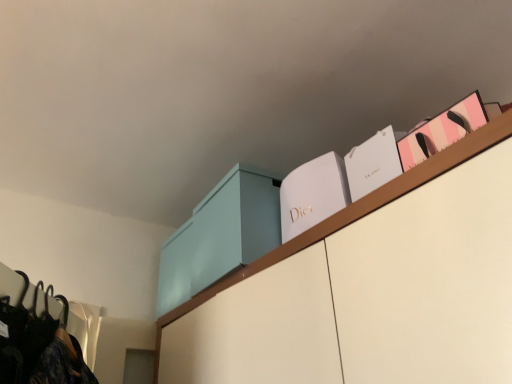
This screenshot has width=512, height=384. In order to click on white matte dior box at upper center, which appears as the first book when viewed from the left in this screenshot , I will do `click(312, 194)`.

Describe the element at coordinates (312, 194) in the screenshot. I see `white matte dior box at upper center, marked as the 3th book in a right-to-left arrangement` at that location.

The width and height of the screenshot is (512, 384). What do you see at coordinates (221, 235) in the screenshot? I see `light blue matte cabinet at upper center` at bounding box center [221, 235].

At what (x,y) coordinates should I click in order to perform the action: click on white matte dior box at upper center, which appears as the first book when viewed from the left. Please return your answer as a coordinate pair (x, y). The width and height of the screenshot is (512, 384). Looking at the image, I should click on (312, 194).

Is pink paper bag at upper right, the 3th book from the left, at the back of light blue matte cabinet at upper center?

No, pink paper bag at upper right, the 3th book from the left, is not at the back of light blue matte cabinet at upper center.

From the image's perspective, which one is positioned lower, light blue matte cabinet at upper center or pink paper bag at upper right, the 3th book from the left?

light blue matte cabinet at upper center.

Does light blue matte cabinet at upper center have a lesser height compared to pink paper bag at upper right, the 1th book positioned from the right?

Incorrect, the height of light blue matte cabinet at upper center does not fall short of that of pink paper bag at upper right, the 1th book positioned from the right.

Based on the photo, is light blue matte cabinet at upper center not near pink paper bag at upper right, the 1th book positioned from the right?

light blue matte cabinet at upper center is near pink paper bag at upper right, the 1th book positioned from the right, not far away.

Is pink paper bag at upper right, the 1th book positioned from the right, turned away from light blue matte cabinet at upper center?

No.

From a real-world perspective, which is physically below, pink paper bag at upper right, the 1th book positioned from the right, or light blue matte cabinet at upper center?

pink paper bag at upper right, the 1th book positioned from the right, is physically lower.

Does pink paper bag at upper right, the 3th book from the left, have a smaller size compared to light blue matte cabinet at upper center?

Correct, pink paper bag at upper right, the 3th book from the left, occupies less space than light blue matte cabinet at upper center.

In terms of width, does pink paper bag at upper right, the 1th book positioned from the right, look wider or thinner when compared to light blue matte cabinet at upper center?

In the image, pink paper bag at upper right, the 1th book positioned from the right, appears to be more narrow than light blue matte cabinet at upper center.

From a real-world perspective, is white paper bag at upper right, marked as the 2th book in a right-to-left arrangement, under pink paper bag at upper right, the 3th book from the left?

Incorrect, from a real-world perspective, white paper bag at upper right, marked as the 2th book in a right-to-left arrangement, is higher than pink paper bag at upper right, the 3th book from the left.

Which object is thinner, white paper bag at upper right, marked as the 2th book in a right-to-left arrangement, or pink paper bag at upper right, the 1th book positioned from the right?

With smaller width is white paper bag at upper right, marked as the 2th book in a right-to-left arrangement.

Which is in front, point (349, 172) or point (435, 117)?

The point (349, 172) is more forward.

Is white paper bag at upper right, the 2th book in the left-to-right sequence, aimed at pink paper bag at upper right, the 3th book from the left?

No, white paper bag at upper right, the 2th book in the left-to-right sequence, is not facing towards pink paper bag at upper right, the 3th book from the left.

Is light blue matte cabinet at upper center turned away from white paper bag at upper right, the 2th book in the left-to-right sequence?

light blue matte cabinet at upper center is not turned away from white paper bag at upper right, the 2th book in the left-to-right sequence.

Find the location of a particular element. The height and width of the screenshot is (384, 512). book that is the 2nd one below the light blue matte cabinet at upper center (from a real-world perspective) is located at coordinates (372, 163).

Based on the photo, from a real-world perspective, is light blue matte cabinet at upper center under white paper bag at upper right, marked as the 2th book in a right-to-left arrangement?

Incorrect, from a real-world perspective, light blue matte cabinet at upper center is higher than white paper bag at upper right, marked as the 2th book in a right-to-left arrangement.

Between light blue matte cabinet at upper center and white paper bag at upper right, the 2th book in the left-to-right sequence, which one has smaller size?

white paper bag at upper right, the 2th book in the left-to-right sequence.

Which is in front, white matte dior box at upper center, which appears as the first book when viewed from the left, or light blue matte cabinet at upper center?

white matte dior box at upper center, which appears as the first book when viewed from the left, is closer to the camera.

Is white matte dior box at upper center, marked as the 3th book in a right-to-left arrangement, positioned far away from light blue matte cabinet at upper center?

No.

Is light blue matte cabinet at upper center at the back of white matte dior box at upper center, which appears as the first book when viewed from the left?

No, white matte dior box at upper center, which appears as the first book when viewed from the left, is not facing away from light blue matte cabinet at upper center.

Image resolution: width=512 pixels, height=384 pixels. I want to click on the 1st book to the right of the light blue matte cabinet at upper center, starting your count from the anchor, so click(x=312, y=194).

Does point (267, 250) come farther from viewer compared to point (337, 172)?

Yes, point (267, 250) is farther from viewer.

Considering their positions, is light blue matte cabinet at upper center located in front of or behind white matte dior box at upper center, which appears as the first book when viewed from the left?

light blue matte cabinet at upper center is behind white matte dior box at upper center, which appears as the first book when viewed from the left.

From a real-world perspective, between light blue matte cabinet at upper center and white matte dior box at upper center, which appears as the first book when viewed from the left, who is vertically higher?

light blue matte cabinet at upper center.

Could you tell me if light blue matte cabinet at upper center is facing white matte dior box at upper center, marked as the 3th book in a right-to-left arrangement?

No, light blue matte cabinet at upper center is not turned towards white matte dior box at upper center, marked as the 3th book in a right-to-left arrangement.

Is white paper bag at upper right, marked as the 2th book in a right-to-left arrangement, oriented away from white matte dior box at upper center, marked as the 3th book in a right-to-left arrangement?

That's not correct — white paper bag at upper right, marked as the 2th book in a right-to-left arrangement, is not looking away from white matte dior box at upper center, marked as the 3th book in a right-to-left arrangement.

Can we say white paper bag at upper right, the 2th book in the left-to-right sequence, lies outside white matte dior box at upper center, marked as the 3th book in a right-to-left arrangement?

Yes, white paper bag at upper right, the 2th book in the left-to-right sequence, is outside of white matte dior box at upper center, marked as the 3th book in a right-to-left arrangement.

Can you tell me how much white paper bag at upper right, marked as the 2th book in a right-to-left arrangement, and white matte dior box at upper center, marked as the 3th book in a right-to-left arrangement, differ in facing direction?

They differ by 0.00233 degrees in their facing directions.

The image size is (512, 384). Identify the location of cabinetry below the pink paper bag at upper right, the 3th book from the left (from the image's perspective). (221, 235).

I want to click on cabinetry behind the pink paper bag at upper right, the 3th book from the left, so click(221, 235).

Estimate the real-world distances between objects in this image. Which object is further from pink paper bag at upper right, the 1th book positioned from the right, white paper bag at upper right, marked as the 2th book in a right-to-left arrangement, or white matte dior box at upper center, which appears as the first book when viewed from the left?

Based on the image, white matte dior box at upper center, which appears as the first book when viewed from the left, appears to be further to pink paper bag at upper right, the 1th book positioned from the right.

From the image, which object appears to be farther from white paper bag at upper right, the 2th book in the left-to-right sequence, pink paper bag at upper right, the 1th book positioned from the right, or light blue matte cabinet at upper center?

Based on the image, light blue matte cabinet at upper center appears to be further to white paper bag at upper right, the 2th book in the left-to-right sequence.

Based on their spatial positions, is pink paper bag at upper right, the 3th book from the left, or white matte dior box at upper center, marked as the 3th book in a right-to-left arrangement, closer to white paper bag at upper right, marked as the 2th book in a right-to-left arrangement?

The object closer to white paper bag at upper right, marked as the 2th book in a right-to-left arrangement, is pink paper bag at upper right, the 3th book from the left.

Looking at this image, which object lies further to the anchor point white paper bag at upper right, marked as the 2th book in a right-to-left arrangement, white matte dior box at upper center, marked as the 3th book in a right-to-left arrangement, or pink paper bag at upper right, the 3th book from the left?

white matte dior box at upper center, marked as the 3th book in a right-to-left arrangement.

When comparing their distances from light blue matte cabinet at upper center, does pink paper bag at upper right, the 1th book positioned from the right, or white matte dior box at upper center, which appears as the first book when viewed from the left, seem further?

The object further to light blue matte cabinet at upper center is pink paper bag at upper right, the 1th book positioned from the right.

From the image, which object appears to be farther from white matte dior box at upper center, which appears as the first book when viewed from the left, light blue matte cabinet at upper center or white paper bag at upper right, the 2th book in the left-to-right sequence?

light blue matte cabinet at upper center is further to white matte dior box at upper center, which appears as the first book when viewed from the left.

Which object lies further to the anchor point white matte dior box at upper center, which appears as the first book when viewed from the left, white paper bag at upper right, the 2th book in the left-to-right sequence, or pink paper bag at upper right, the 3th book from the left?

pink paper bag at upper right, the 3th book from the left, is positioned further to the anchor white matte dior box at upper center, which appears as the first book when viewed from the left.

Estimate the real-world distances between objects in this image. Which object is closer to white matte dior box at upper center, marked as the 3th book in a right-to-left arrangement, light blue matte cabinet at upper center or pink paper bag at upper right, the 1th book positioned from the right?

pink paper bag at upper right, the 1th book positioned from the right, lies closer to white matte dior box at upper center, marked as the 3th book in a right-to-left arrangement, than the other object.

The height and width of the screenshot is (384, 512). I want to click on book between white matte dior box at upper center, marked as the 3th book in a right-to-left arrangement, and pink paper bag at upper right, the 1th book positioned from the right, in the horizontal direction, so click(x=372, y=163).

Find the location of `book between light blue matte cabinet at upper center and white paper bag at upper right, marked as the 2th book in a right-to-left arrangement, in the horizontal direction`. book between light blue matte cabinet at upper center and white paper bag at upper right, marked as the 2th book in a right-to-left arrangement, in the horizontal direction is located at coordinates (312, 194).